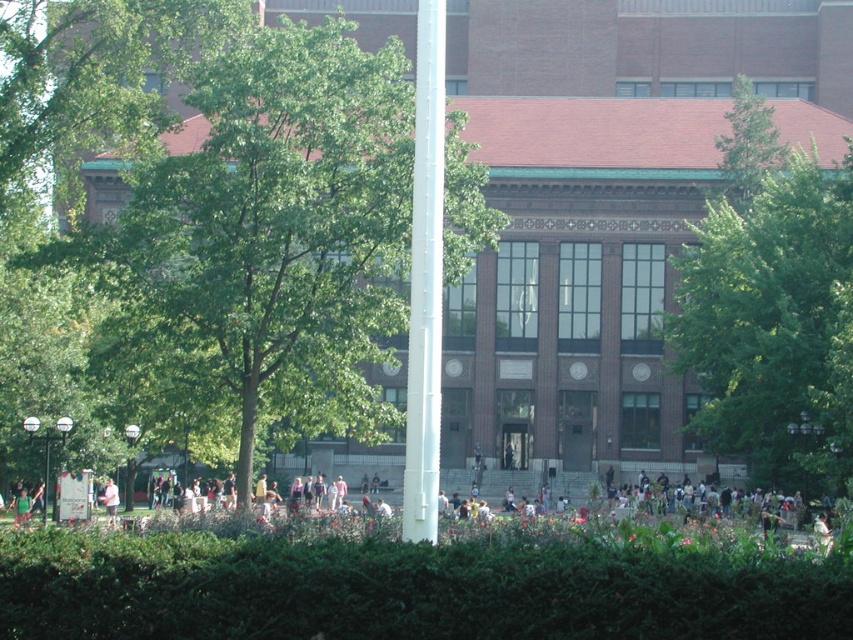
Question: Which point appears closest to the camera in this image?

Choices:
 (A) (428, 129)
 (B) (822, 230)

Answer: (A)

Question: Where is green leafy hedge at center located in relation to white metal pole at center in the image?

Choices:
 (A) above
 (B) below

Answer: (A)

Question: Which of the following is the farthest from the observer?

Choices:
 (A) (840, 609)
 (B) (231, 205)
 (C) (102, 13)
 (D) (131, 492)

Answer: (D)

Question: Among these points, which one is farthest from the camera?

Choices:
 (A) tap(25, 424)
 (B) tap(683, 330)
 (C) tap(108, 513)

Answer: (B)

Question: Can you confirm if metallic silver lamp post at center is positioned below white metal pole at center?

Choices:
 (A) no
 (B) yes

Answer: (A)

Question: From the image, what is the correct spatial relationship of green leafy tree at center in relation to green leafy hedge at center?

Choices:
 (A) left
 (B) right

Answer: (A)